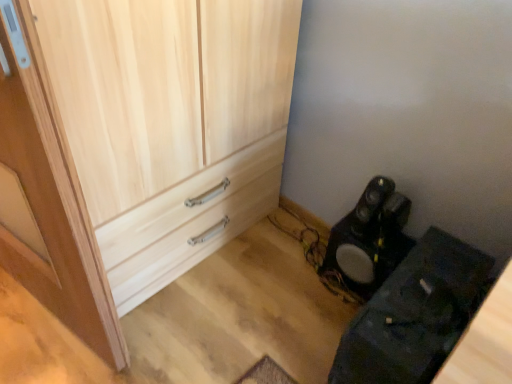
Describe the element at coordinates (368, 247) in the screenshot. I see `black matte speaker at lower right` at that location.

The width and height of the screenshot is (512, 384). I want to click on black matte speaker at lower right, so click(368, 247).

Is wooden door at left in contact with black matte speaker at lower right?

No, wooden door at left is not with black matte speaker at lower right.

Which of these two, wooden door at left or black matte speaker at lower right, is bigger?

Bigger between the two is wooden door at left.

Which object is thinner, wooden door at left or black matte speaker at lower right?

wooden door at left.

From a real-world perspective, which object rests below the other?

In real-world perspective, black matte speaker at lower right is lower.

What's the angular difference between natural wood cupboard at center and black matte speaker at lower right's facing directions?

90 degrees.

Where is `speaker below the natural wood cupboard at center (from a real-world perspective)`? This screenshot has width=512, height=384. speaker below the natural wood cupboard at center (from a real-world perspective) is located at coordinates [x=368, y=247].

From a real-world perspective, is natural wood cupboard at center physically located above or below black matte speaker at lower right?

Clearly, from a real-world perspective, natural wood cupboard at center is above black matte speaker at lower right.

Based on the photo, is black matte speaker at lower right at the back of wooden door at left?

No, wooden door at left's orientation is not away from black matte speaker at lower right.

Is wooden door at left taller or shorter than black matte speaker at lower right?

Considering their sizes, wooden door at left has more height than black matte speaker at lower right.

How many degrees apart are the facing directions of wooden door at left and black matte speaker at lower right?

6.36 degrees.

Locate an element on the screen. door in front of the natural wood cupboard at center is located at coordinates (52, 195).

Is wooden door at left far away from natural wood cupboard at center?

Actually, wooden door at left and natural wood cupboard at center are a little close together.

From the image's perspective, relative to natural wood cupboard at center, is wooden door at left above or below?

wooden door at left is below natural wood cupboard at center.

Based on the photo, is black matte speaker at lower right completely or partially outside of wooden door at left?

That's correct, black matte speaker at lower right is outside of wooden door at left.

From a real-world perspective, is black matte speaker at lower right above or below wooden door at left?

In terms of real-world spatial position, black matte speaker at lower right is below wooden door at left.

Is black matte speaker at lower right bigger or smaller than wooden door at left?

Clearly, black matte speaker at lower right is smaller in size than wooden door at left.

From the image's perspective, which object appears higher, black matte speaker at lower right or wooden door at left?

From the image's view, wooden door at left is above.

Does point (296, 28) appear closer or farther from the camera than point (49, 132)?

Clearly, point (296, 28) is more distant from the camera than point (49, 132).

In terms of height, does natural wood cupboard at center look taller or shorter compared to wooden door at left?

natural wood cupboard at center is shorter than wooden door at left.

From the picture: Is natural wood cupboard at center beside wooden door at left?

No, natural wood cupboard at center is not making contact with wooden door at left.

From a real-world perspective, which is physically below, natural wood cupboard at center or wooden door at left?

From a 3D spatial view, natural wood cupboard at center is below.

Are black matte speaker at lower right and black matte speaker at lower right located far from each other?

No, black matte speaker at lower right is in close proximity to black matte speaker at lower right.

Looking at this image, how much distance is there between black matte speaker at lower right and black matte speaker at lower right?

12.91 inches.

Does black matte speaker at lower right appear on the left side of black matte speaker at lower right?

No, black matte speaker at lower right is not to the left of black matte speaker at lower right.

Based on the photo, how different are the orientations of black matte speaker at lower right and black matte speaker at lower right in degrees?

The angular difference between black matte speaker at lower right and black matte speaker at lower right is 0.42 degrees.

Identify the location of door that is on the left side of black matte speaker at lower right. (52, 195).

This screenshot has height=384, width=512. In order to click on cupboard in front of the black matte speaker at lower right in this screenshot , I will do `click(140, 141)`.

Considering their positions, is natural wood cupboard at center positioned further to wooden door at left than black matte speaker at lower right?

black matte speaker at lower right is further to wooden door at left.

Based on their spatial positions, is wooden door at left or black matte speaker at lower right closer to black matte speaker at lower right?

black matte speaker at lower right is positioned closer to the anchor black matte speaker at lower right.

In the scene shown: From the image, which object appears to be nearer to wooden door at left, natural wood cupboard at center or black matte speaker at lower right?

natural wood cupboard at center is positioned closer to the anchor wooden door at left.

Which object lies nearer to the anchor point black matte speaker at lower right, black matte speaker at lower right or wooden door at left?

black matte speaker at lower right is closer to black matte speaker at lower right.

When comparing their distances from black matte speaker at lower right, does natural wood cupboard at center or black matte speaker at lower right seem closer?

black matte speaker at lower right lies closer to black matte speaker at lower right than the other object.

Estimate the real-world distances between objects in this image. Which object is closer to natural wood cupboard at center, black matte speaker at lower right or wooden door at left?

wooden door at left.

Looking at the image, which one is located closer to wooden door at left, black matte speaker at lower right or natural wood cupboard at center?

natural wood cupboard at center is closer to wooden door at left.

Which object lies nearer to the anchor point black matte speaker at lower right, wooden door at left or natural wood cupboard at center?

Among the two, natural wood cupboard at center is located nearer to black matte speaker at lower right.

The image size is (512, 384). In order to click on cupboard between wooden door at left and black matte speaker at lower right from left to right in this screenshot , I will do `click(140, 141)`.

Locate an element on the screen. The height and width of the screenshot is (384, 512). cupboard between wooden door at left and black matte speaker at lower right from left to right is located at coordinates (140, 141).

Image resolution: width=512 pixels, height=384 pixels. I want to click on speaker between natural wood cupboard at center and black matte speaker at lower right from left to right, so click(x=368, y=247).

In order to click on speaker between wooden door at left and black matte speaker at lower right in the horizontal direction in this screenshot , I will do `click(368, 247)`.